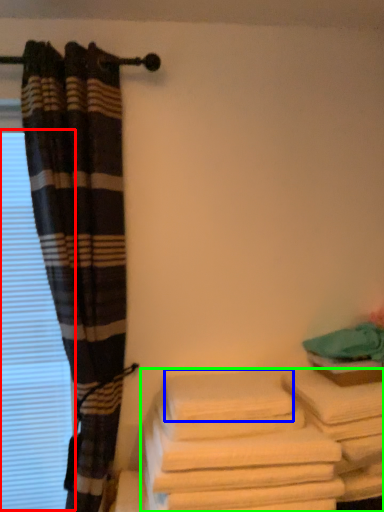
Question: Which object is the closest to the window (highlighted by a red box)? Choose among these: bath towel (highlighted by a blue box) or towel (highlighted by a green box).

Choices:
 (A) bath towel
 (B) towel

Answer: (A)